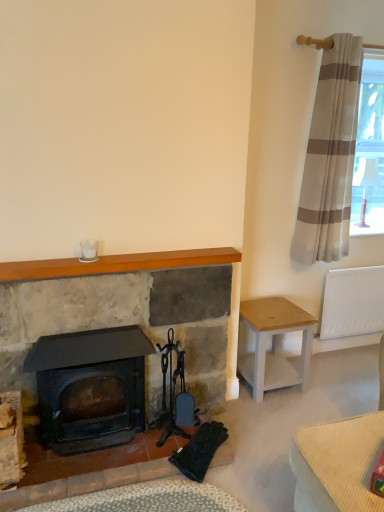
Question: In terms of width, does wooden mantle at upper center look wider or thinner when compared to white wood stool at right?

Choices:
 (A) thin
 (B) wide

Answer: (A)

Question: Does point (36, 272) appear closer or farther from the camera than point (266, 390)?

Choices:
 (A) farther
 (B) closer

Answer: (B)

Question: Which of these objects is positioned farthest from the white glass at upper center?

Choices:
 (A) wooden mantle at upper center
 (B) matte stone fireplace at center
 (C) white plastic radiator at right
 (D) beige striped curtain at upper right
 (E) matte black wood burning stove at center-left

Answer: (C)

Question: Which object is positioned closest to the beige striped curtain at upper right?

Choices:
 (A) white plastic radiator at right
 (B) white wood stool at right
 (C) wooden mantle at upper center
 (D) matte stone fireplace at center
 (E) white glass at upper center

Answer: (A)